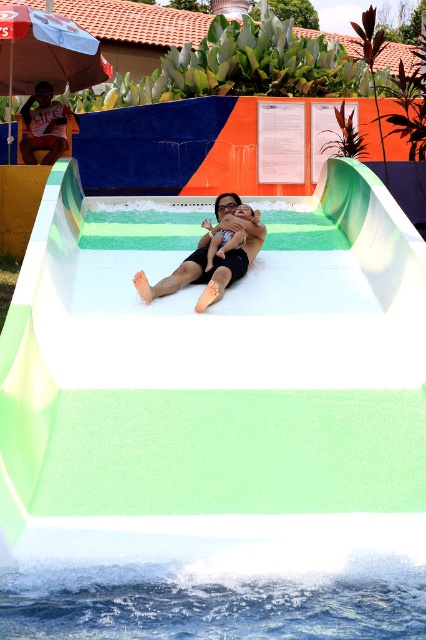
Question: Is white fabric umbrella at upper left smaller than black smooth skin at center?

Choices:
 (A) yes
 (B) no

Answer: (B)

Question: Does black smooth skin at center appear on the right side of transparent plastic goggles at center?

Choices:
 (A) yes
 (B) no

Answer: (B)

Question: Which object is closer to the camera taking this photo?

Choices:
 (A) matte orange shorts at upper left
 (B) matte black swimsuit at center
 (C) transparent plastic goggles at center
 (D) black smooth skin at center

Answer: (B)

Question: Which of the following is the farthest from the observer?

Choices:
 (A) white fabric umbrella at upper left
 (B) white smooth water slide at center
 (C) matte orange shorts at upper left
 (D) black smooth skin at center

Answer: (A)

Question: Can you confirm if black smooth skin at center is positioned above transparent plastic goggles at center?

Choices:
 (A) no
 (B) yes

Answer: (A)

Question: Which point is closer to the camera taking this photo?

Choices:
 (A) (264, 305)
 (B) (259, 250)
 (C) (17, 44)

Answer: (A)